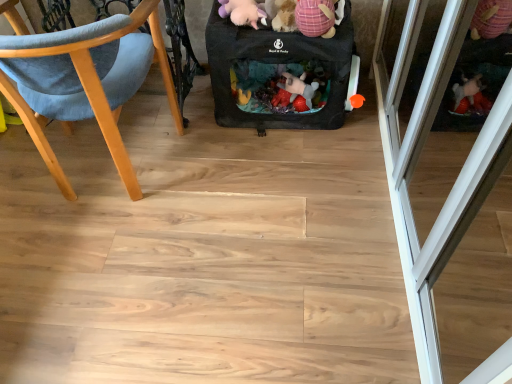
Image resolution: width=512 pixels, height=384 pixels. What are the coordinates of `spots to the right of wooden chair at left` in the screenshot? It's located at (236, 182).